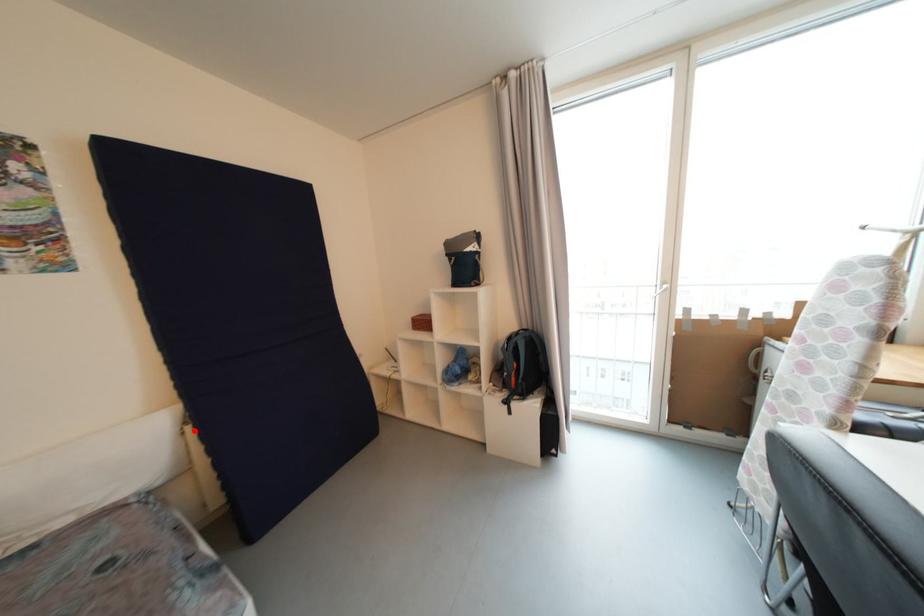
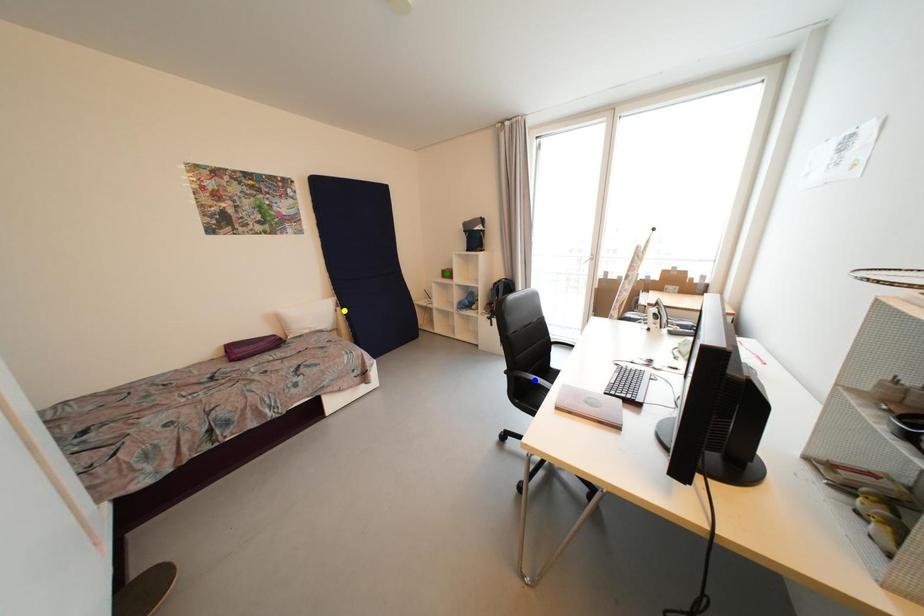
Question: I am providing you with two images of the same scene from different viewpoints. A red point is marked on the first image. You are given multiple points on the second image. Which point in image 2 represents the same 3d spot as the red point in image 1?

Choices:
 (A) green point
 (B) yellow point
 (C) blue point

Answer: (B)